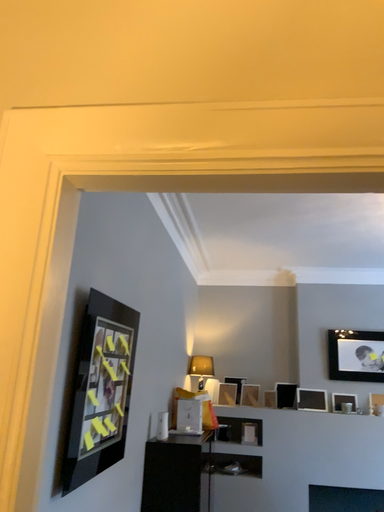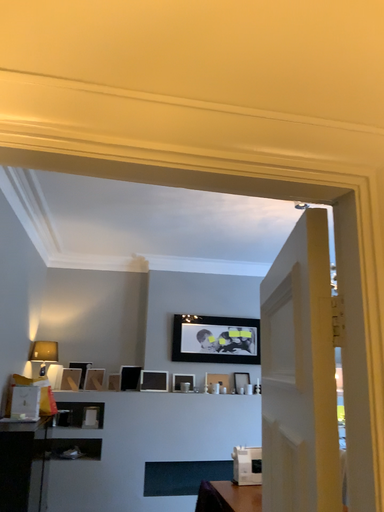
Question: How did the camera likely rotate when shooting the video?

Choices:
 (A) rotated right
 (B) rotated left

Answer: (A)